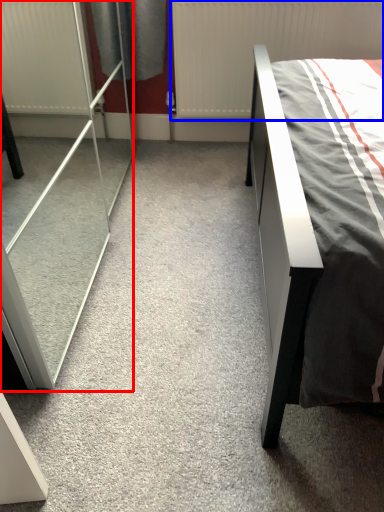
Question: Which object appears farthest to the camera in this image, screen door (highlighted by a red box) or radiator (highlighted by a blue box)?

Choices:
 (A) screen door
 (B) radiator

Answer: (B)